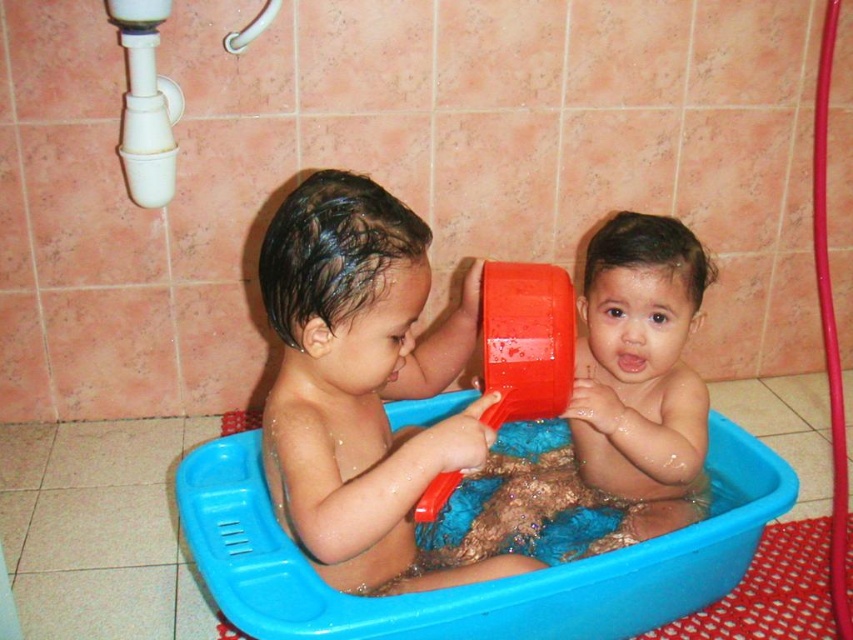
Question: Which of these objects is positioned closest to the matte plastic boy at center?

Choices:
 (A) blue plastic tub at center
 (B) matte plastic baby at center
 (C) white plastic shower at upper left

Answer: (A)

Question: Is matte plastic baby at center positioned at the back of white plastic shower at upper left?

Choices:
 (A) no
 (B) yes

Answer: (A)

Question: Which point is farther to the camera?

Choices:
 (A) matte plastic baby at center
 (B) white plastic shower at upper left
 (C) matte plastic boy at center

Answer: (B)

Question: Is matte plastic boy at center closer to the viewer compared to blue plastic tub at center?

Choices:
 (A) yes
 (B) no

Answer: (A)

Question: Can you confirm if blue plastic tub at center is positioned above matte plastic baby at center?

Choices:
 (A) no
 (B) yes

Answer: (A)

Question: Which object is closer to the camera taking this photo?

Choices:
 (A) matte plastic baby at center
 (B) blue plastic tub at center
 (C) white plastic shower at upper left
 (D) matte plastic boy at center

Answer: (D)